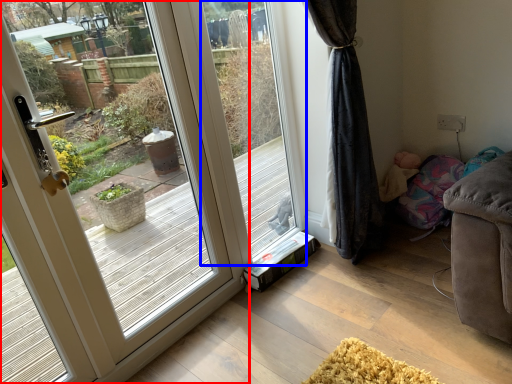
Question: Among these objects, which one is farthest to the camera, door (highlighted by a red box) or window screen (highlighted by a blue box)?

Choices:
 (A) door
 (B) window screen

Answer: (B)